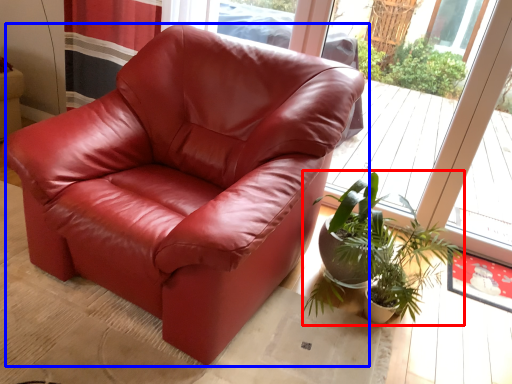
Question: Which object is further to the camera taking this photo, houseplant (highlighted by a red box) or chair (highlighted by a blue box)?

Choices:
 (A) houseplant
 (B) chair

Answer: (A)